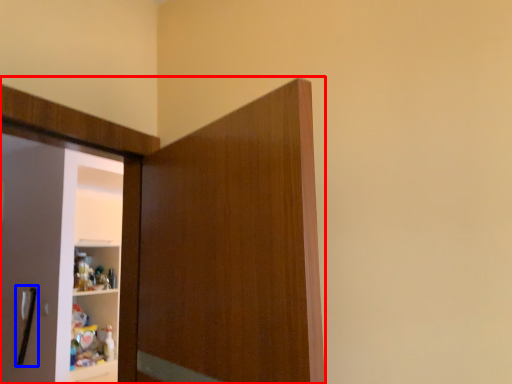
Question: Which point is closer to the camera, cupboard (highlighted by a red box) or door handle (highlighted by a blue box)?

Choices:
 (A) cupboard
 (B) door handle

Answer: (A)